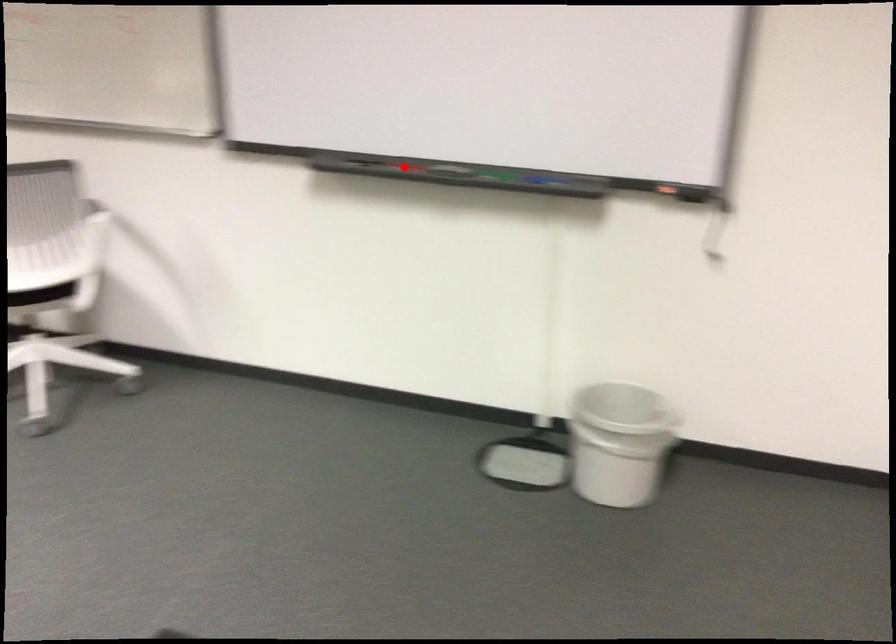
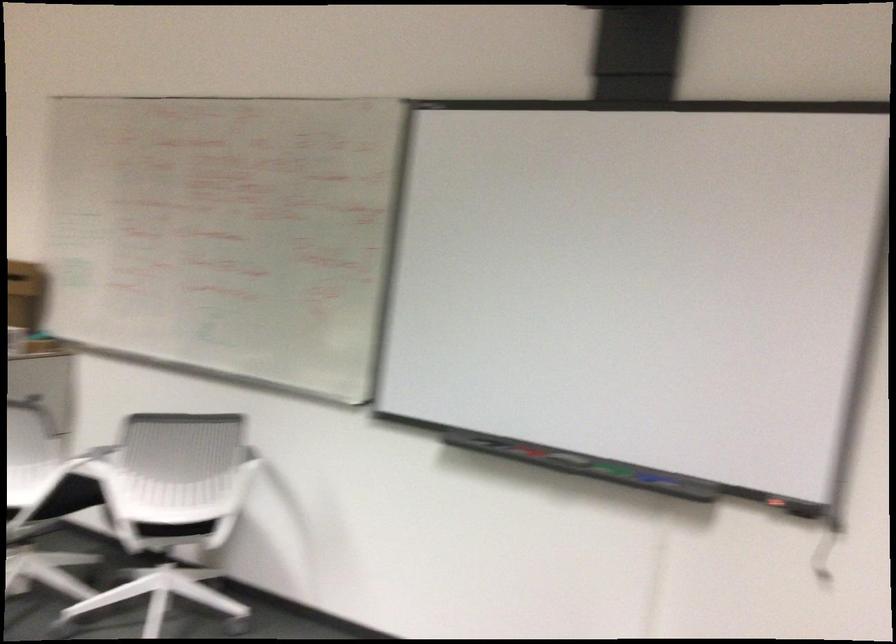
Locate, in the second image, the point that corresponds to the highlighted location in the first image.

(527, 451)